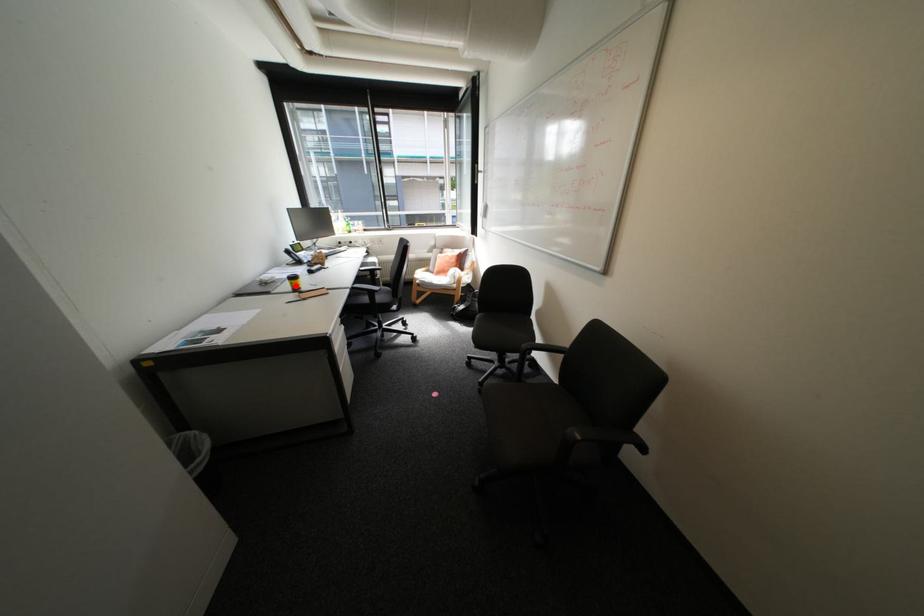
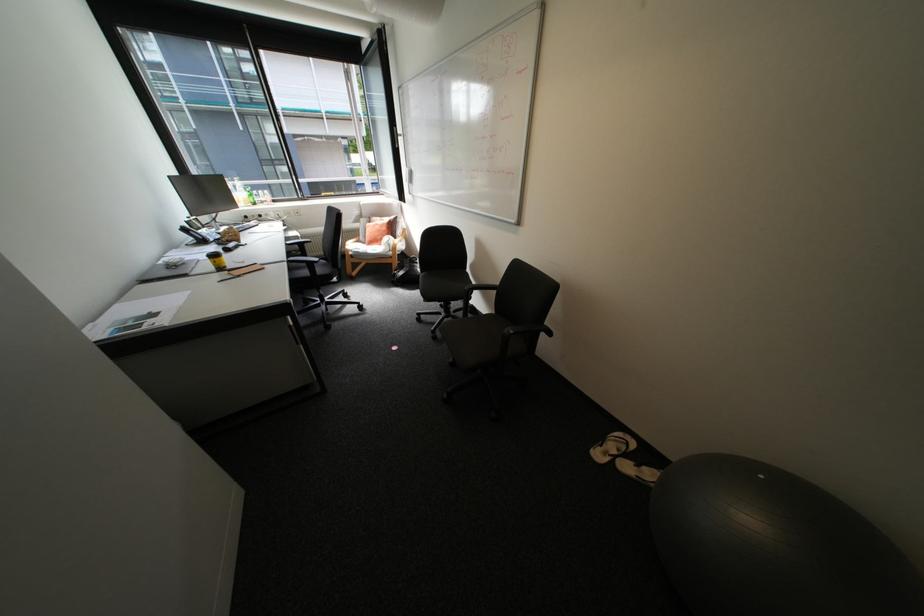
Locate, in the second image, the point that corresponds to the highlighted location in the first image.

(217, 265)